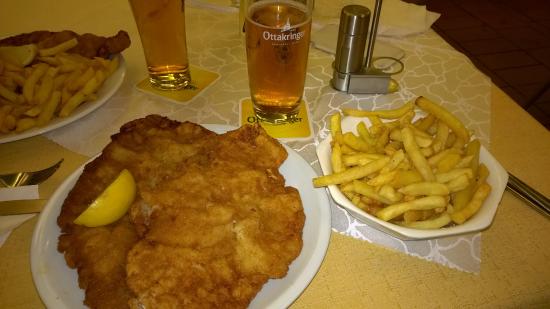
Locate an element on the screen. The image size is (550, 309). fork is located at coordinates (31, 178).